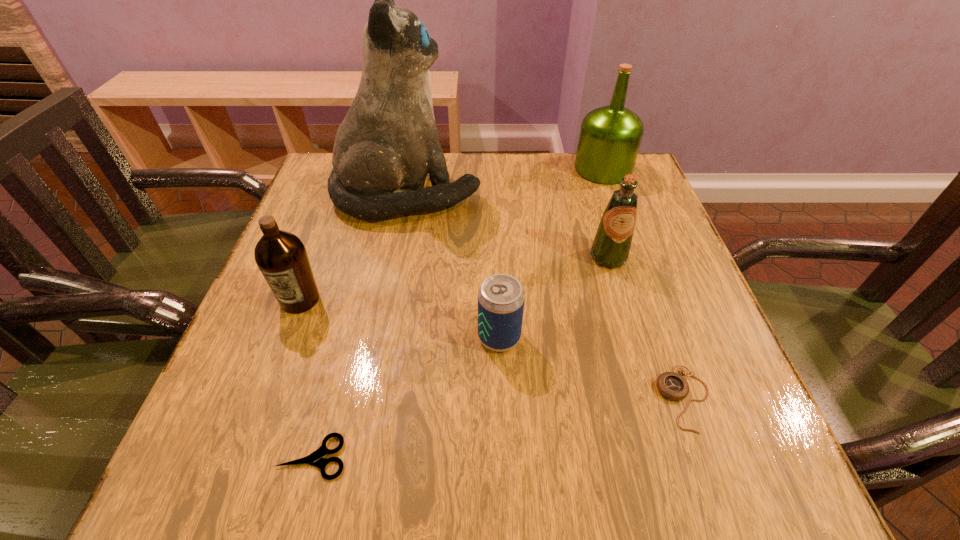
Identify which olive oil is the closest to the nearest object. Please provide its 2D coordinates. Your answer should be formatted as a tuple, i.e. [(x, y)], where the tuple contains the x and y coordinates of a point satisfying the conditions above.

[(281, 256)]

The width and height of the screenshot is (960, 540). In order to click on free space in the image that satisfies the following two spatial constraints: 1. on the label of the pocket watch; 2. on the left side of the leftmost olive oil in this screenshot , I will do `click(263, 399)`.

Identify the location of vacant region that satisfies the following two spatial constraints: 1. on the label of the beer can; 2. on the right side of the leftmost olive oil. This screenshot has width=960, height=540. (286, 337).

Image resolution: width=960 pixels, height=540 pixels. In order to click on free spot that satisfies the following two spatial constraints: 1. on the label of the leftmost olive oil; 2. on the right side of the shears in this screenshot , I will do `click(241, 457)`.